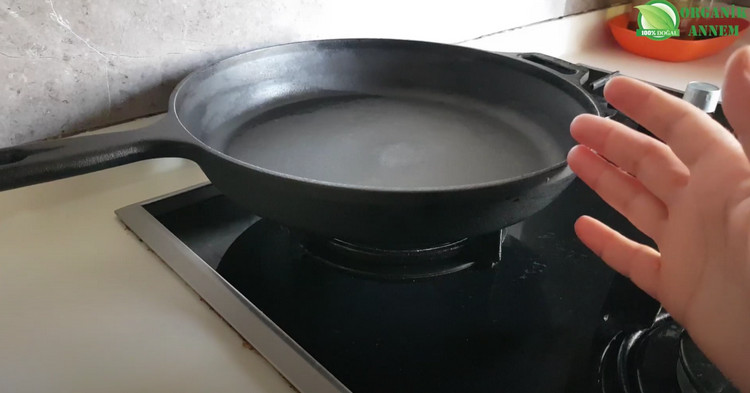
You are a GUI agent. You are given a task and a screenshot of the screen. Output one action in this format:
    pyautogui.click(x=<x>, y=<y>)
    Task: Click on the back left burner of stove
    This screenshot has width=750, height=393.
    Given the screenshot: What is the action you would take?
    pyautogui.click(x=430, y=275), pyautogui.click(x=394, y=250)